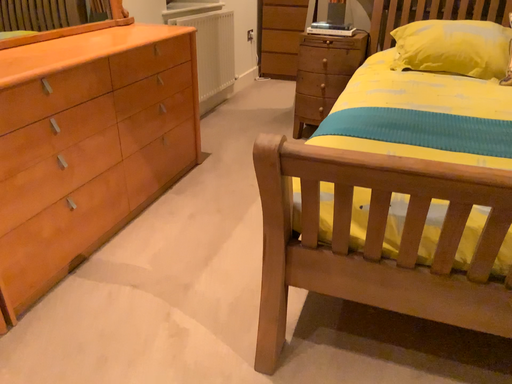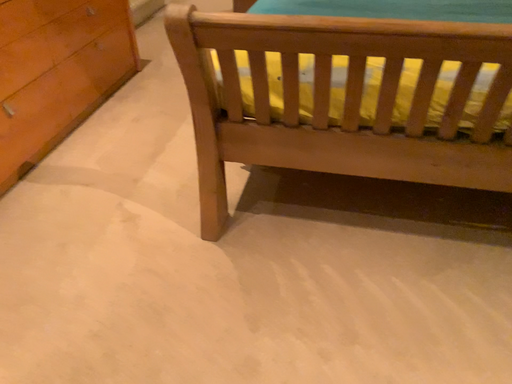
Question: Which way did the camera rotate in the video?

Choices:
 (A) rotated downward
 (B) rotated upward

Answer: (A)